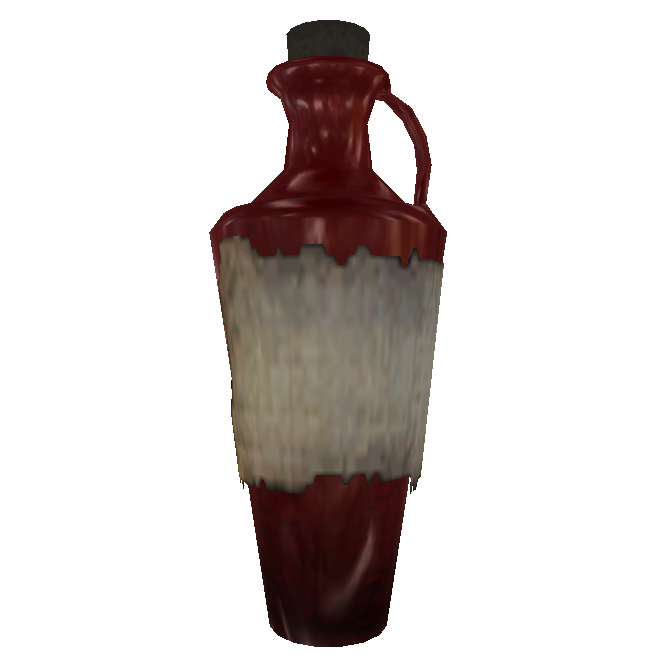
Locate an element on the screen. The image size is (660, 660). cork is located at coordinates tap(331, 40).